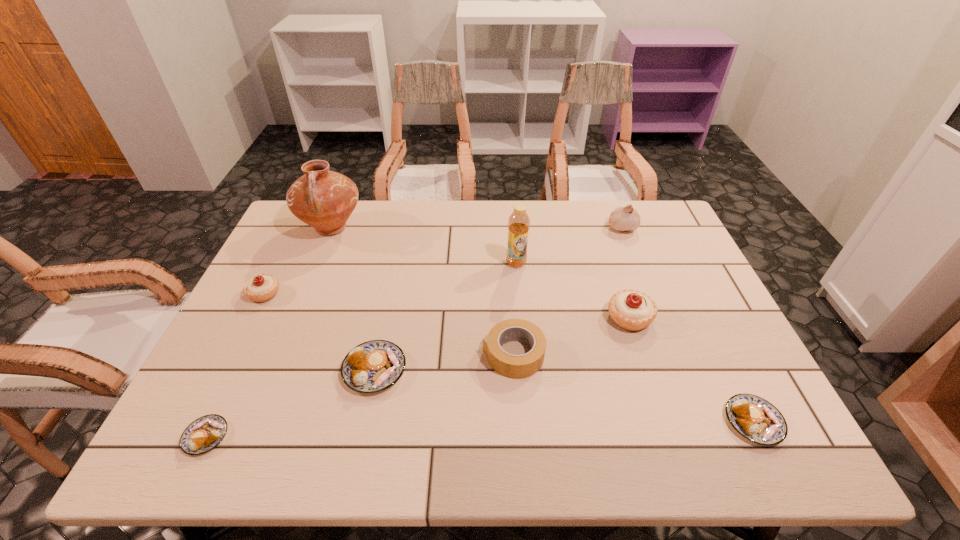
Identify the location of free space between the garlic and the shortest object. The image size is (960, 540). (414, 332).

Select which object is the sixth closest to the third shortest pastry. Please provide its 2D coordinates. Your answer should be formatted as a tuple, i.e. [(x, y)], where the tuple contains the x and y coordinates of a point satisfying the conditions above.

[(633, 310)]

The height and width of the screenshot is (540, 960). What are the coordinates of `the fourth closest object to the bigger beige pastry` in the screenshot? It's located at (622, 218).

Point out which pastry is positioned as the nearest to the duct tape. Please provide its 2D coordinates. Your answer should be formatted as a tuple, i.e. [(x, y)], where the tuple contains the x and y coordinates of a point satisfying the conditions above.

[(633, 310)]

Where is `pastry that is the fourth closest one to the duct tape`? The width and height of the screenshot is (960, 540). pastry that is the fourth closest one to the duct tape is located at coordinates (201, 436).

Identify the location of brown pastry that is the second closest to the rightmost pastry. Image resolution: width=960 pixels, height=540 pixels. (201, 436).

You are a GUI agent. You are given a task and a screenshot of the screen. Output one action in this format:
    pyautogui.click(x=<x>, y=<y>)
    Task: Click on the brown pastry that is the nearest to the tallest pastry
    The height and width of the screenshot is (540, 960).
    Given the screenshot: What is the action you would take?
    pyautogui.click(x=756, y=419)

Identify the location of free space in the image that satisfies the following two spatial constraints: 1. on the back side of the garlic; 2. on the left side of the shortest pastry. (306, 227).

You are a GUI agent. You are given a task and a screenshot of the screen. Output one action in this format:
    pyautogui.click(x=<x>, y=<y>)
    Task: Click on the vacant point that satisfies the following two spatial constraints: 1. on the back side of the smallest brown pastry; 2. on the left side of the rightmost brown pastry
    
    Given the screenshot: What is the action you would take?
    pyautogui.click(x=213, y=422)

I want to click on blank space that satisfies the following two spatial constraints: 1. on the side of the pottery with the handle; 2. on the right side of the second biggest brown pastry, so click(x=252, y=422).